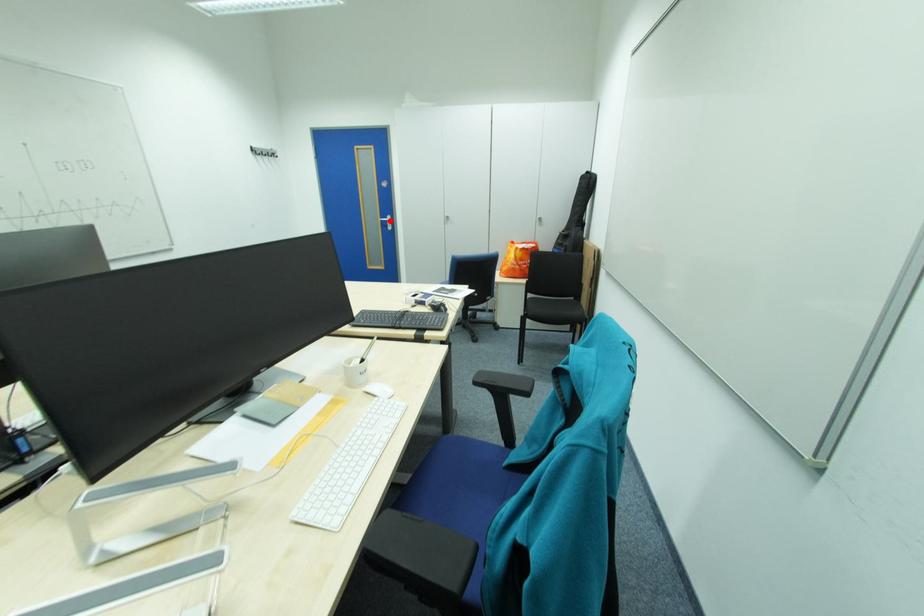
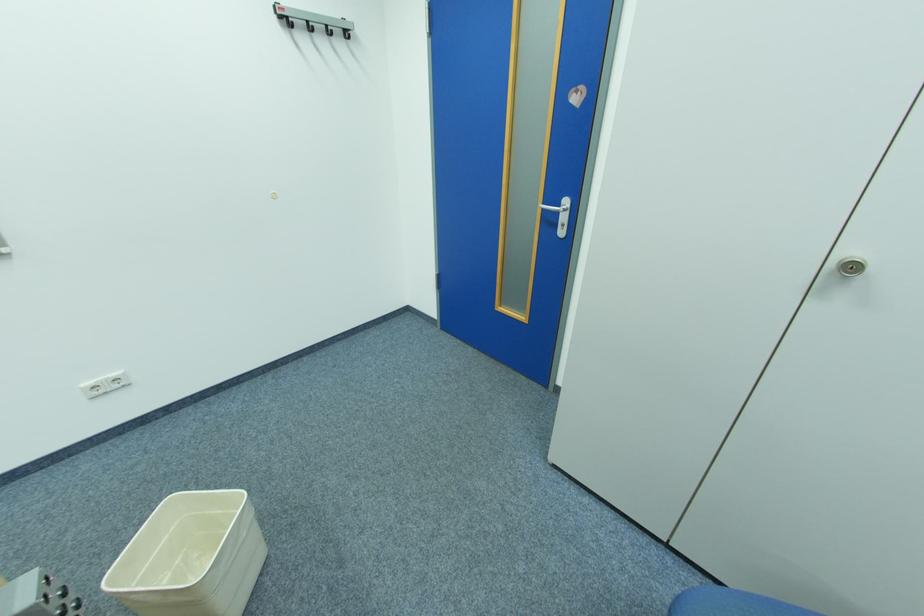
Question: I am providing you with two images of the same scene from different viewpoints. A red point is shown in image1. For the corresponding object point in image2, is it positioned nearer or farther from the camera?

Choices:
 (A) Nearer
 (B) Farther

Answer: (B)